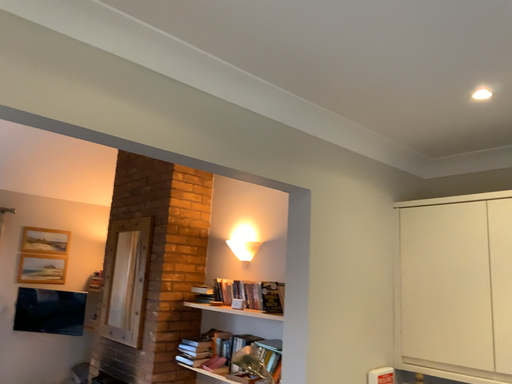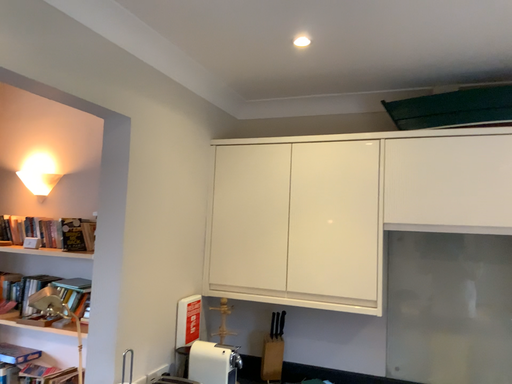
Question: Which way did the camera rotate in the video?

Choices:
 (A) rotated left
 (B) rotated right

Answer: (B)